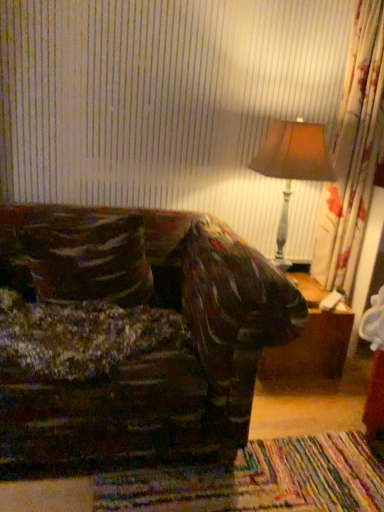
This screenshot has height=512, width=384. I want to click on velvety brown throw pillow at left, so click(79, 257).

From a real-world perspective, is matte brown lampshade at upper right on top of brown wooden table at lower right?

Yes, from a real-world perspective, matte brown lampshade at upper right is on top of brown wooden table at lower right.

Considering the relative sizes of matte brown lampshade at upper right and brown wooden table at lower right in the image provided, is matte brown lampshade at upper right taller than brown wooden table at lower right?

Yes, matte brown lampshade at upper right is taller than brown wooden table at lower right.

How many degrees apart are the facing directions of matte brown lampshade at upper right and brown wooden table at lower right?

The facing directions of matte brown lampshade at upper right and brown wooden table at lower right are 0.000632 degrees apart.

From the image's perspective, does matte brown lampshade at upper right appear higher than brown wooden table at lower right?

Indeed, from the image's perspective, matte brown lampshade at upper right is shown above brown wooden table at lower right.

Is brown wooden table at lower right situated inside velvety brown throw pillow at left or outside?

brown wooden table at lower right is outside velvety brown throw pillow at left.

Considering the positions of points (265, 366) and (39, 295), is point (265, 366) closer to camera compared to point (39, 295)?

No, (265, 366) is further to viewer.

Between brown wooden table at lower right and velvety brown throw pillow at left, which one is positioned in front?

velvety brown throw pillow at left.

Could you tell me if brown wooden table at lower right is turned towards velvety brown throw pillow at left?

No, brown wooden table at lower right is not facing towards velvety brown throw pillow at left.

Consider the image. Can you tell me how much brown wooden table at lower right and matte brown lampshade at upper right differ in facing direction?

The angular difference between brown wooden table at lower right and matte brown lampshade at upper right is 0.000632 degrees.

From a real-world perspective, who is located lower, brown wooden table at lower right or matte brown lampshade at upper right?

brown wooden table at lower right.

Visually, is brown wooden table at lower right positioned to the left or to the right of matte brown lampshade at upper right?

brown wooden table at lower right is positioned on matte brown lampshade at upper right's right side.

Considering the relative positions of velvety brown throw pillow at left and matte brown lampshade at upper right in the image provided, is velvety brown throw pillow at left to the left or to the right of matte brown lampshade at upper right?

In the image, velvety brown throw pillow at left appears on the left side of matte brown lampshade at upper right.

The height and width of the screenshot is (512, 384). Find the location of `throw pillow that is on the left side of matte brown lampshade at upper right`. throw pillow that is on the left side of matte brown lampshade at upper right is located at coordinates (79, 257).

From the image's perspective, is velvety brown throw pillow at left positioned above or below matte brown lampshade at upper right?

velvety brown throw pillow at left is situated lower than matte brown lampshade at upper right in the image.

Is point (92, 269) positioned after point (284, 128)?

No, it is in front of (284, 128).

Considering the relative positions of matte brown lampshade at upper right and velvety brown throw pillow at left in the image provided, is matte brown lampshade at upper right to the right of velvety brown throw pillow at left from the viewer's perspective?

Yes.

Can you confirm if matte brown lampshade at upper right is wider than velvety brown throw pillow at left?

Yes, matte brown lampshade at upper right is wider than velvety brown throw pillow at left.

Does matte brown lampshade at upper right lie in front of velvety brown throw pillow at left?

No, it is behind velvety brown throw pillow at left.

Is matte brown lampshade at upper right looking in the opposite direction of velvety brown throw pillow at left?

That's not correct — matte brown lampshade at upper right is not looking away from velvety brown throw pillow at left.

In the image, is velvety brown throw pillow at left positioned in front of or behind brown wooden table at lower right?

Clearly, velvety brown throw pillow at left is in front of brown wooden table at lower right.

Is velvety brown throw pillow at left oriented away from brown wooden table at lower right?

No, velvety brown throw pillow at left is not facing away from brown wooden table at lower right.

From the image's perspective, is velvety brown throw pillow at left on brown wooden table at lower right?

Indeed, from the image's perspective, velvety brown throw pillow at left is shown above brown wooden table at lower right.

Looking at this image, which object is positioned more to the right, velvety brown throw pillow at left or brown wooden table at lower right?

Positioned to the right is brown wooden table at lower right.

This screenshot has height=512, width=384. I want to click on table lamp that appears above the brown wooden table at lower right (from the image's perspective), so click(x=292, y=165).

Image resolution: width=384 pixels, height=512 pixels. I want to click on table behind the velvety brown throw pillow at left, so click(x=311, y=341).

Which object lies further to the anchor point velvety brown throw pillow at left, brown wooden table at lower right or matte brown lampshade at upper right?

Based on the image, brown wooden table at lower right appears to be further to velvety brown throw pillow at left.

When comparing their distances from brown wooden table at lower right, does matte brown lampshade at upper right or velvety brown throw pillow at left seem closer?

matte brown lampshade at upper right is closer to brown wooden table at lower right.

When comparing their distances from matte brown lampshade at upper right, does brown wooden table at lower right or velvety brown throw pillow at left seem closer?

brown wooden table at lower right is closer to matte brown lampshade at upper right.

Looking at the image, which one is located closer to velvety brown throw pillow at left, matte brown lampshade at upper right or brown wooden table at lower right?

matte brown lampshade at upper right.

When comparing their distances from matte brown lampshade at upper right, does velvety brown throw pillow at left or brown wooden table at lower right seem closer?

brown wooden table at lower right lies closer to matte brown lampshade at upper right than the other object.

In the scene shown: Considering their positions, is velvety brown throw pillow at left positioned further to brown wooden table at lower right than matte brown lampshade at upper right?

velvety brown throw pillow at left is positioned further to the anchor brown wooden table at lower right.

You are a GUI agent. You are given a task and a screenshot of the screen. Output one action in this format:
    pyautogui.click(x=<x>, y=<y>)
    Task: Click on the table lamp between velvety brown throw pillow at left and brown wooden table at lower right in the horizontal direction
    This screenshot has height=512, width=384.
    Given the screenshot: What is the action you would take?
    pyautogui.click(x=292, y=165)